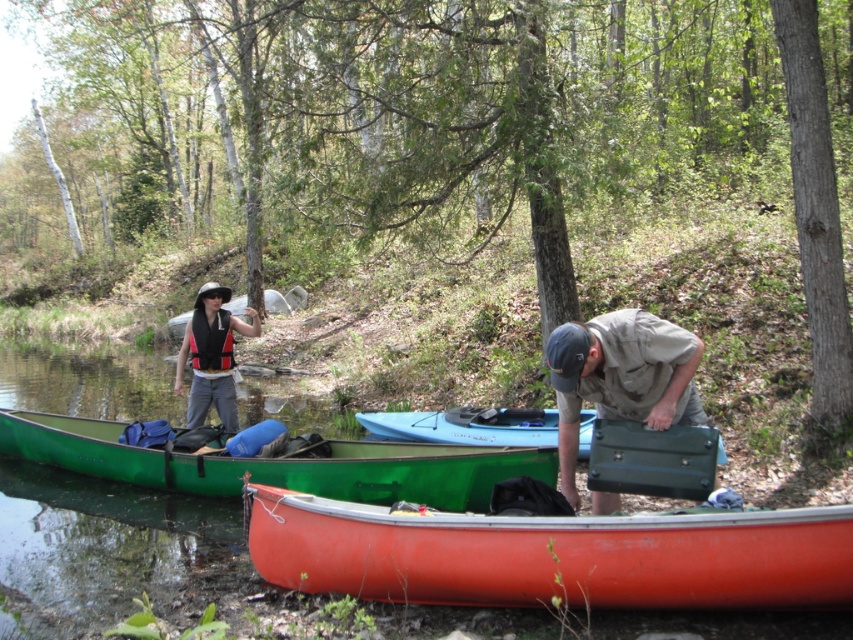
You are planning to board the light blue plastic canoe at center for a short trip. There is a matte black life vest at left nearby. Can you easily reach the life vest while sitting in the canoe?

The matte black life vest at left is behind the light blue plastic canoe at center, so it might be difficult to reach while sitting in the canoe.

You are planning to carry the green matte canoe at lower left and the green matte briefcase at lower center to the water. Which object will be easier to carry because of its size?

The green matte canoe at lower left is thinner than the green matte briefcase at lower center, so it will be easier to carry due to its smaller size.

You are a park ranger who needs to check the distance between the smooth orange canoe at lower center and the light blue plastic canoe at center to ensure safety regulations are met. According to the park rules, canoes must be at least 5 meters apart. Is the current distance compliant with the regulation?

The distance between the smooth orange canoe at lower center and the light blue plastic canoe at center is 4.25 meters, which is less than the required 5 meters. Therefore, the canoes are not compliant with the safety regulations.